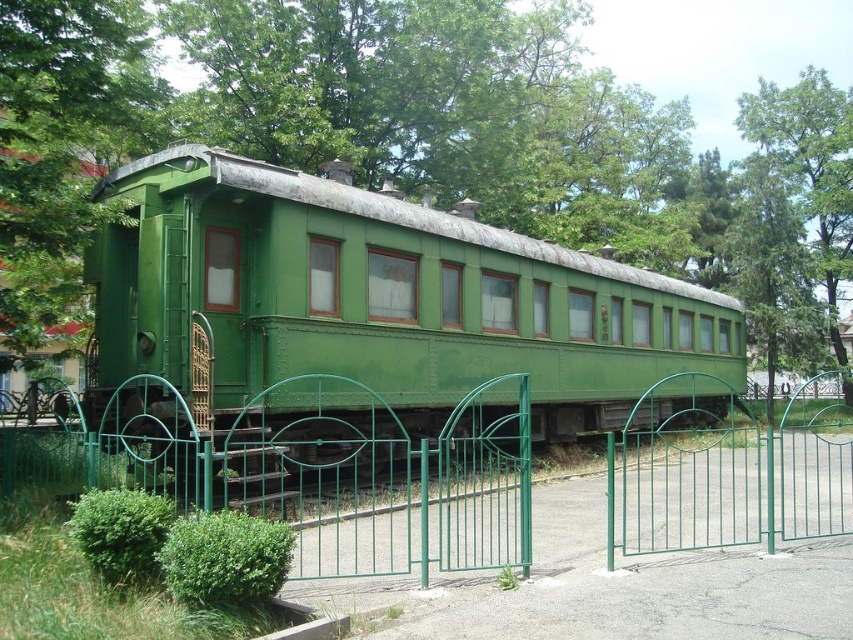
You are a visitor at a historical exhibit and want to take a photo of the green matte train car at center. There is a green matte tree at upper center in the background. Will the tree block the entire train car in your photo?

The green matte tree at upper center is larger in size than the green matte train car at center, so it might block part of the train car depending on the angle and distance, but not necessarily the entire train car.

You are a visitor at the historical train exhibit and want to take a photo of the green metal gate at center and the green leafy tree at upper right. Which object is wider?

The green metal gate at center is wider than the green leafy tree at upper right according to the description.

You are a visitor standing at the entrance of the park and see the green matte tree at upper center and the green matte train car at center. Which object is closer to you?

The green matte tree at upper center is closer to you because it is in front of the green matte train car at center.